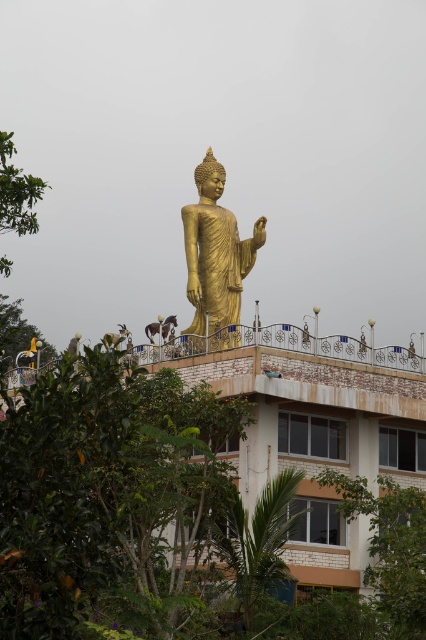
You are a photographer planning to capture a wide shot of the gold polished statue at center and the green leafy tree at lower left. Based on their sizes, which object should you focus on first to ensure both fit in the frame?

The gold polished statue at center might be wider than the green leafy tree at lower left, so focusing on the statue first would help ensure both fit in the frame.

You are a photographer aiming to capture the gold polished statue at center without any obstructions. Considering the green leafy tree at lower left, is the statue positioned in a way that allows for an unobstructed view?

The gold polished statue at center is in front of the green leafy tree at lower left, so the statue is positioned in front and would block the view of the tree. However, since the question is about capturing the statue without obstructions from the tree, the statue itself is not obstructed by the tree. Therefore, you can take a clear photo of the gold polished statue at center without any obstruction from the green leafy tree at lower left.